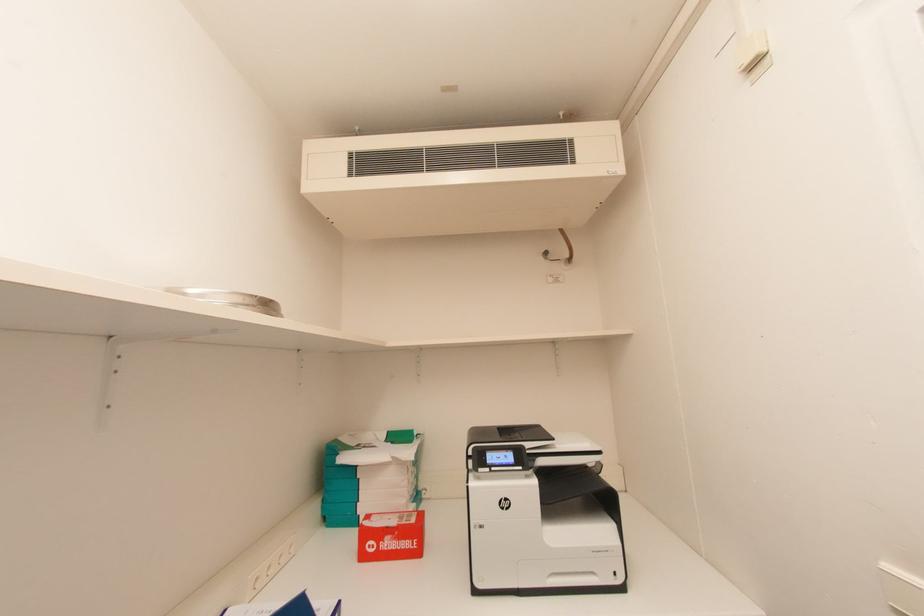
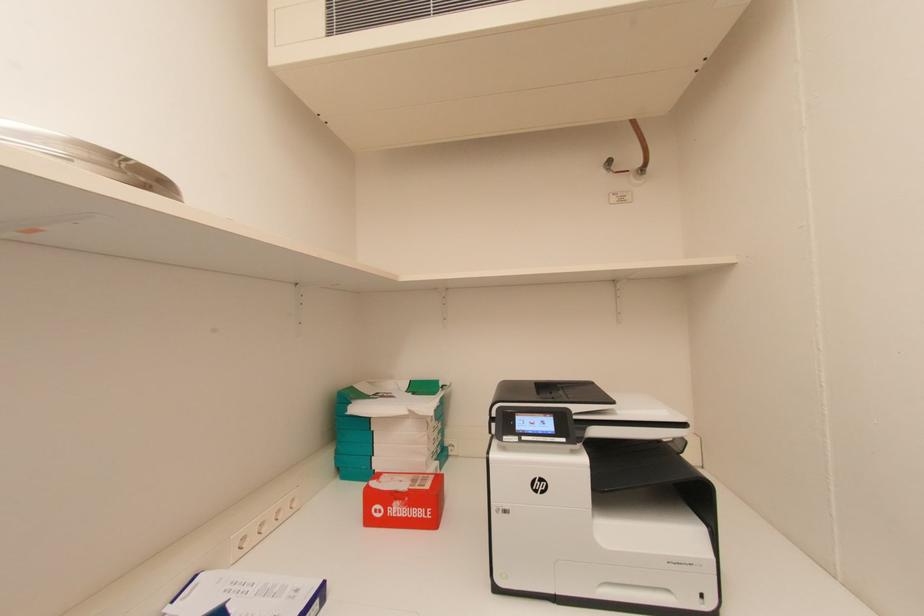
Question: In a continuous first-person perspective shot, in which direction is the camera moving?

Choices:
 (A) Left
 (B) Right
 (C) Forward
 (D) Backward

Answer: (C)